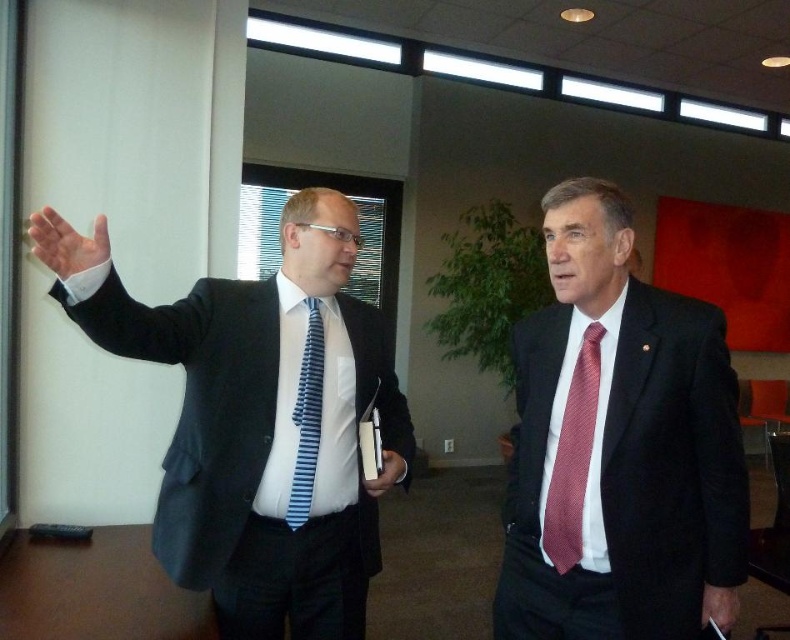
You are a photographer setting up for a group photo. You need to position yourself so that both the matte black suit at left and the red textured tie at right are in focus. Which object should you focus on first to ensure both are sharp?

You should focus on the matte black suit at left first because it is closer to the viewer than the red textured tie at right, so focusing on the closer object will help ensure both are in focus.

You are an interior designer who needs to place a new sofa that is 1.5 meters wide in this office scene. Where should you position it so that it doesn not block the matte black suit at right?

The matte black suit at right is located at coordinates point (617, 444). To avoid blocking it, place the sofa away from that position, ensuring there is enough space between them.

You are standing in an office and see the matte black suit at right. You need to hand a document to the person wearing it. Can you reach them without moving closer than 1.5 meters?

The distance between the matte black suit at right and the viewer is 1.41 meters, which is less than 1.5 meters. Therefore, you cannot reach them without moving closer than 1.5 meters.